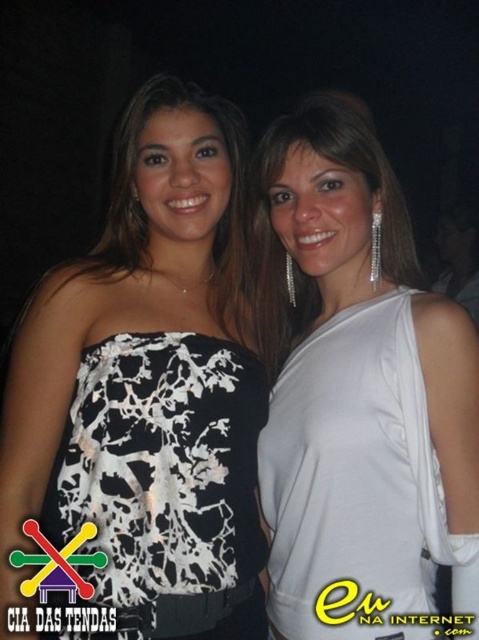
You are a photographer at a social event. You need to determine which dress is larger between the white satin dress at center and the white printed fabric dress at left. Based on the scene description, which dress is bigger?

The white satin dress at center is bigger than the white printed fabric dress at left according to the description.

You are a photographer at a social event and notice two women wearing white dresses. The first woman is wearing a white printed fabric dress at left, and the second is wearing a white printed dress at left. Which dress is positioned to the right of the other?

The white printed fabric dress at left is positioned on the right side of the white printed dress at left.

You are a photographer at a social event. You need to adjust the lighting to ensure both the white printed dress at center and the white printed dress at left are visible. Since the background is dark, which dress might require more light to be properly illuminated?

Result: The white printed dress at center is bigger than the white printed dress at left, so it might require more light to ensure proper illumination due to its larger size.